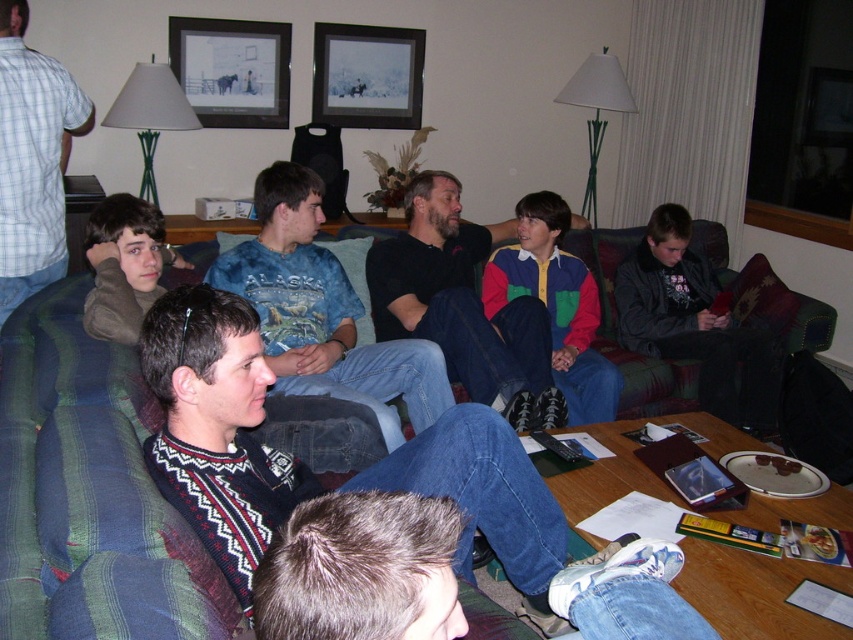
Question: Is blue tie-dye shirt at center bigger than black cotton shirt at center?

Choices:
 (A) no
 (B) yes

Answer: (A)

Question: Which point is closer to the camera taking this photo?

Choices:
 (A) (340, 28)
 (B) (252, 241)
 (C) (502, 371)
 (D) (807, 298)

Answer: (C)

Question: Observing the image, what is the correct spatial positioning of metallic silver picture frame at upper center in reference to black matte picture frame at upper center?

Choices:
 (A) right
 (B) left

Answer: (B)

Question: Which of the following is the closest to the observer?

Choices:
 (A) green striped fabric couch at center
 (B) black cotton shirt at center

Answer: (A)

Question: Which point appears closest to the camera in this image?

Choices:
 (A) (233, 288)
 (B) (16, 19)
 (C) (381, 262)

Answer: (A)

Question: Is metallic silver picture frame at upper center positioned behind black matte picture frame at upper center?

Choices:
 (A) yes
 (B) no

Answer: (B)